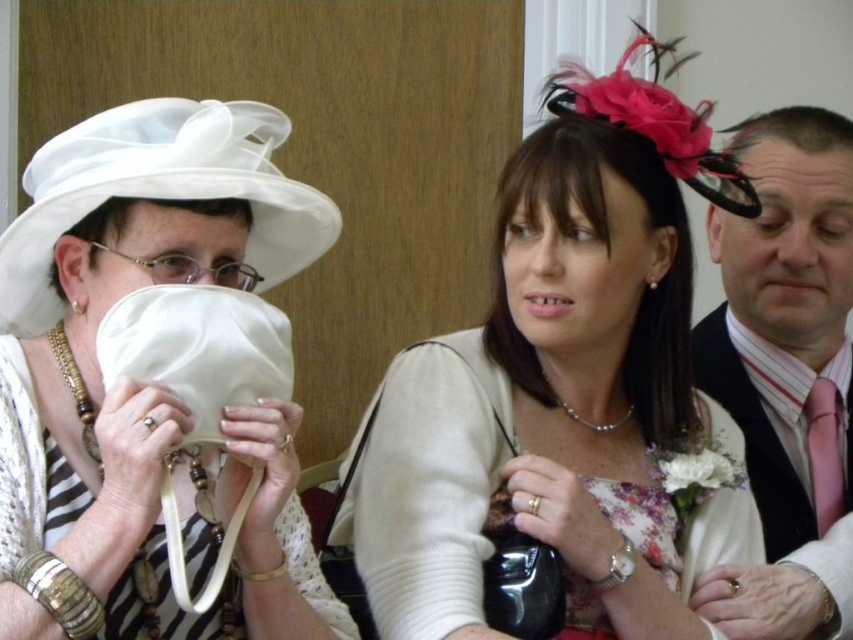
Can you confirm if satin floral dress at center is positioned to the right of pink satin tie at right?

Incorrect, satin floral dress at center is not on the right side of pink satin tie at right.

Find the location of `satin floral dress at center`. satin floral dress at center is located at coordinates (564, 392).

Is point (561, 134) positioned after point (277, 179)?

Yes, point (561, 134) is behind point (277, 179).

Between point (616, 604) and point (91, 317), which one is positioned in front?

Positioned in front is point (91, 317).

This screenshot has width=853, height=640. Find the location of `satin floral dress at center`. satin floral dress at center is located at coordinates (564, 392).

Between matte white hat at left and pink satin tie at right, which one appears on the left side from the viewer's perspective?

From the viewer's perspective, matte white hat at left appears more on the left side.

Can you confirm if matte white hat at left is positioned above pink satin tie at right?

Yes.

Measure the distance between matte white hat at left and camera.

matte white hat at left and camera are 29.31 inches apart from each other.

Where is `matte white hat at left`? This screenshot has height=640, width=853. matte white hat at left is located at coordinates (96, 333).